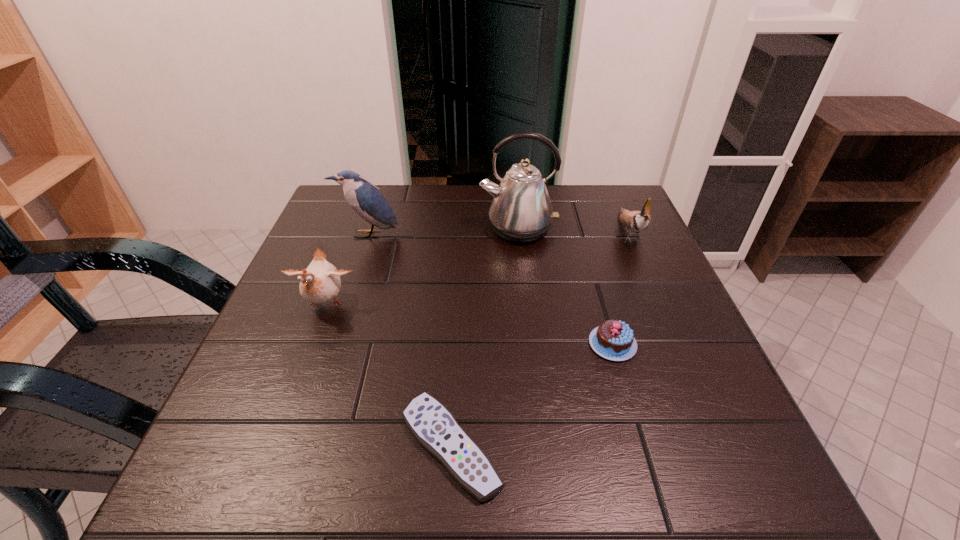
You are a GUI agent. You are given a task and a screenshot of the screen. Output one action in this format:
    pyautogui.click(x=<x>, y=<y>)
    Task: Click on the vacant space that is in between the second tallest object and the tallest object
    
    Given the screenshot: What is the action you would take?
    pyautogui.click(x=444, y=232)

At what (x,y) coordinates should I click in order to perform the action: click on free spot between the rightmost bird and the second object from right to left. Please return your answer as a coordinate pair (x, y). Looking at the image, I should click on (620, 288).

The image size is (960, 540). Find the location of `vacant area that lies between the kettle and the second tallest object`. vacant area that lies between the kettle and the second tallest object is located at coordinates (444, 232).

I want to click on vacant area that lies between the fifth farthest object and the rightmost bird, so click(620, 288).

Select which object is the third closest to the fifth object from left to right. Please provide its 2D coordinates. Your answer should be formatted as a tuple, i.e. [(x, y)], where the tuple contains the x and y coordinates of a point satisfying the conditions above.

[(521, 211)]

Identify which object is located as the nearest to the chocolate cake. Please provide its 2D coordinates. Your answer should be formatted as a tuple, i.e. [(x, y)], where the tuple contains the x and y coordinates of a point satisfying the conditions above.

[(435, 428)]

Identify which bird is the third nearest to the nearest object. Please provide its 2D coordinates. Your answer should be formatted as a tuple, i.e. [(x, y)], where the tuple contains the x and y coordinates of a point satisfying the conditions above.

[(636, 221)]

Select which bird is the closest to the second tallest object. Please provide its 2D coordinates. Your answer should be formatted as a tuple, i.e. [(x, y)], where the tuple contains the x and y coordinates of a point satisfying the conditions above.

[(319, 283)]

Where is `free space that satisfies the following two spatial constraints: 1. at the beak of the chocolate cake; 2. on the left side of the nearest bird`? free space that satisfies the following two spatial constraints: 1. at the beak of the chocolate cake; 2. on the left side of the nearest bird is located at coordinates (311, 344).

In order to click on free location that satisfies the following two spatial constraints: 1. from the spout of the tallest object; 2. on the left side of the chocolate cake in this screenshot , I will do `click(531, 344)`.